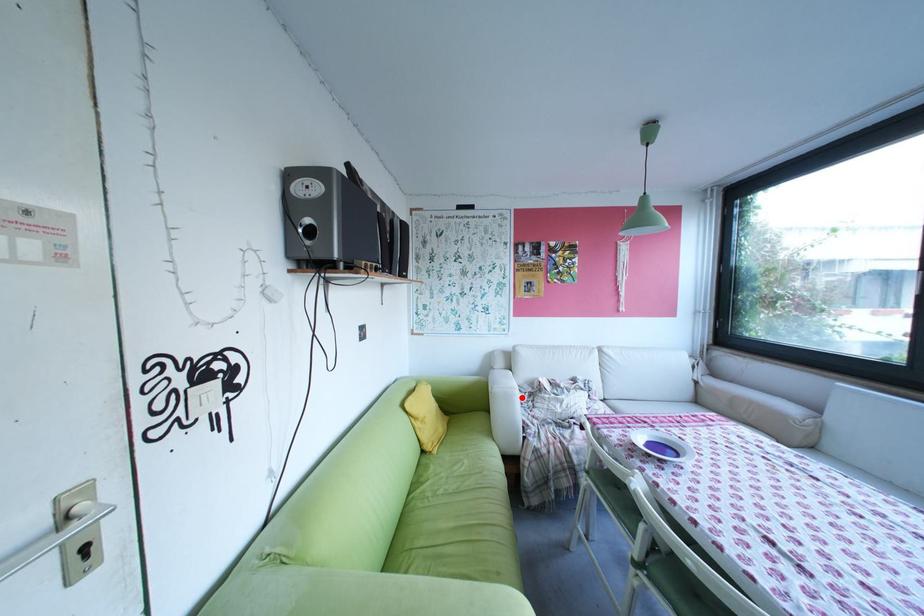
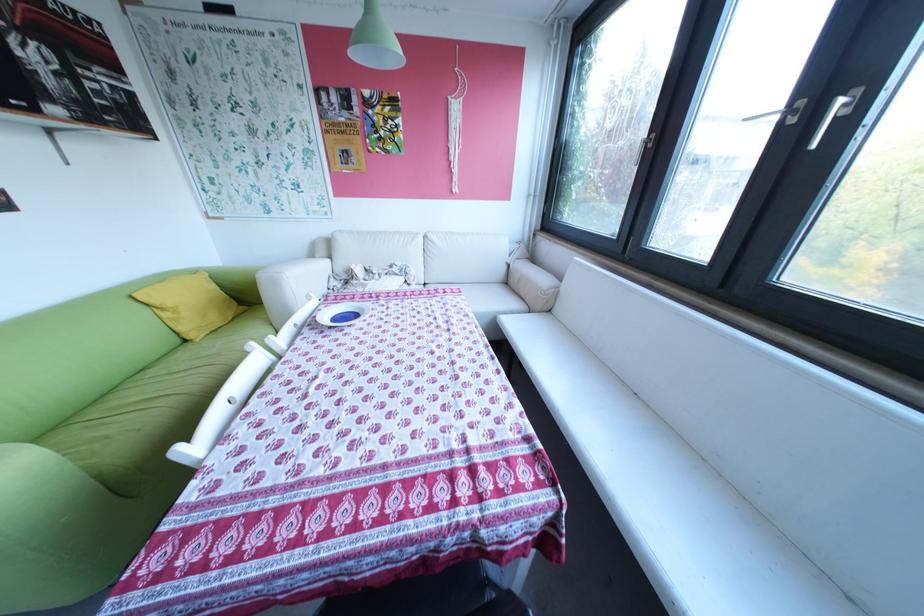
The point at the highlighted location is marked in the first image. Where is the corresponding point in the second image?

(288, 283)